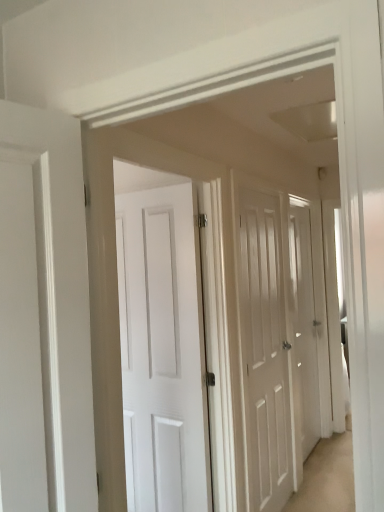
Question: In terms of height, does white matte door at center, which ranks as the first door in right-to-left order, look taller or shorter compared to white wood door at center, the 1th door positioned from the left?

Choices:
 (A) short
 (B) tall

Answer: (A)

Question: Considering the relative positions of white matte door at center, which is the 1th door from back to front, and white wood door at center, placed as the second door when sorted from back to front, in the image provided, is white matte door at center, which is the 1th door from back to front, to the left or to the right of white wood door at center, placed as the second door when sorted from back to front,?

Choices:
 (A) right
 (B) left

Answer: (A)

Question: Is white matte door at center, which is the 1th door from back to front, wider or thinner than white wood door at center, the 1th door positioned from the left?

Choices:
 (A) thin
 (B) wide

Answer: (A)

Question: Is white wood door at center, which ranks as the 1th door in front-to-back order, to the left or to the right of white matte door at center, which is the 1th door from back to front, in the image?

Choices:
 (A) left
 (B) right

Answer: (A)

Question: Considering the positions of white wood door at center, the 1th door positioned from the left, and white matte door at center, positioned as the 2th door in front-to-back order, in the image, is white wood door at center, the 1th door positioned from the left, wider or thinner than white matte door at center, positioned as the 2th door in front-to-back order,?

Choices:
 (A) thin
 (B) wide

Answer: (B)

Question: Is white wood door at center, placed as the second door when sorted from back to front, bigger or smaller than white matte door at center, positioned as the 2th door in front-to-back order?

Choices:
 (A) big
 (B) small

Answer: (A)

Question: Does point (259, 297) appear closer or farther from the camera than point (299, 374)?

Choices:
 (A) closer
 (B) farther

Answer: (A)